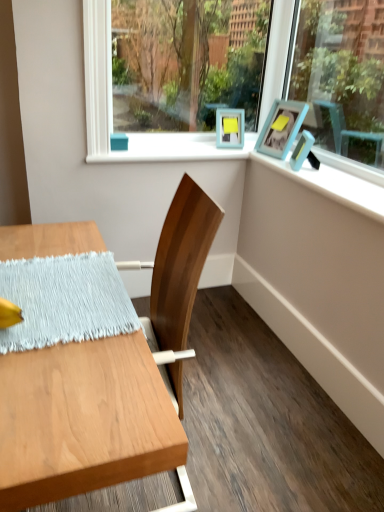
Question: Is blue painted wood at upper right shorter than light blue woven placemat at left?

Choices:
 (A) yes
 (B) no

Answer: (B)

Question: Is blue painted wood at upper right beside light blue woven placemat at left?

Choices:
 (A) no
 (B) yes

Answer: (A)

Question: Is blue painted wood at upper right located outside light blue woven placemat at left?

Choices:
 (A) no
 (B) yes

Answer: (B)

Question: Is blue painted wood at upper right further to camera compared to light blue woven placemat at left?

Choices:
 (A) yes
 (B) no

Answer: (A)

Question: From the image's perspective, is blue painted wood at upper right beneath light blue woven placemat at left?

Choices:
 (A) yes
 (B) no

Answer: (B)

Question: Is blue painted wood at upper right thinner than light blue woven placemat at left?

Choices:
 (A) yes
 (B) no

Answer: (A)

Question: Is blue painted wood at upper right bigger than teal matte picture frame at upper right, which ranks as the second picture frame in front-to-back order?

Choices:
 (A) yes
 (B) no

Answer: (A)

Question: Does blue painted wood at upper right have a lesser width compared to teal matte picture frame at upper right, the 1th picture frame positioned from the back?

Choices:
 (A) no
 (B) yes

Answer: (A)

Question: Are blue painted wood at upper right and teal matte picture frame at upper right, which ranks as the second picture frame in front-to-back order, located far from each other?

Choices:
 (A) yes
 (B) no

Answer: (B)

Question: Does blue painted wood at upper right appear on the right side of teal matte picture frame at upper right, the 1th picture frame positioned from the back?

Choices:
 (A) no
 (B) yes

Answer: (B)

Question: From a real-world perspective, does blue painted wood at upper right sit lower than teal matte picture frame at upper right, the 1th picture frame positioned from the back?

Choices:
 (A) no
 (B) yes

Answer: (B)

Question: Is blue painted wood at upper right not within teal matte picture frame at upper right, the 1th picture frame positioned from the back?

Choices:
 (A) no
 (B) yes

Answer: (B)

Question: Does matte blue picture frame at upper right, arranged as the first picture frame when viewed from the front, appear on the right side of blue painted wood at upper right?

Choices:
 (A) no
 (B) yes

Answer: (A)